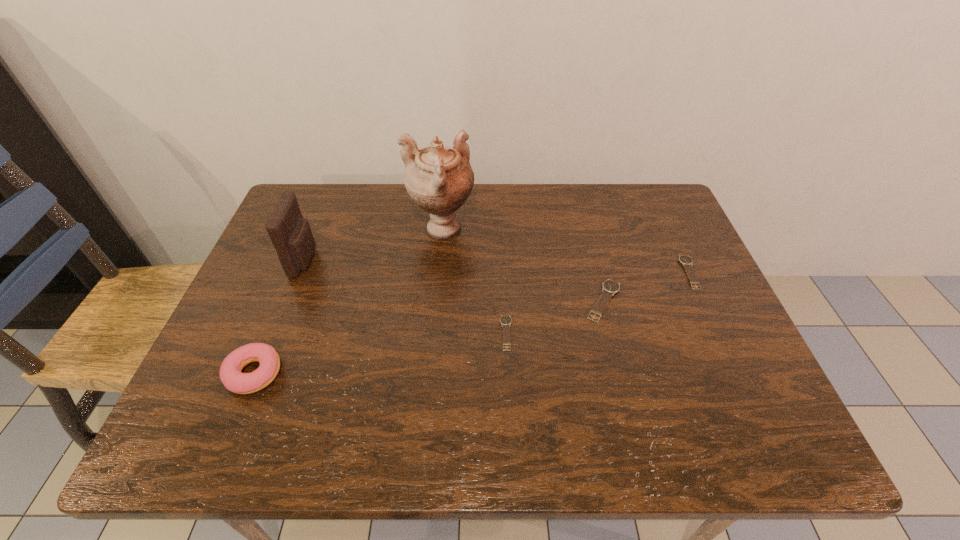
Considering the uniform spacing of watchs, where should an additional watch be positioned on the left? Please locate a free spot. Please provide its 2D coordinates. Your answer should be formatted as a tuple, i.e. [(x, y)], where the tuple contains the x and y coordinates of a point satisfying the conditions above.

[(395, 369)]